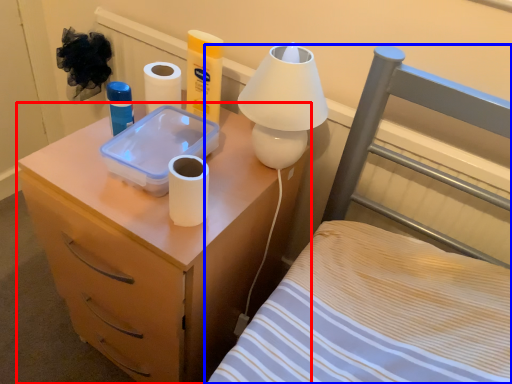
Question: Which object is closer to the camera taking this photo, nightstand (highlighted by a red box) or furniture (highlighted by a blue box)?

Choices:
 (A) nightstand
 (B) furniture

Answer: (A)